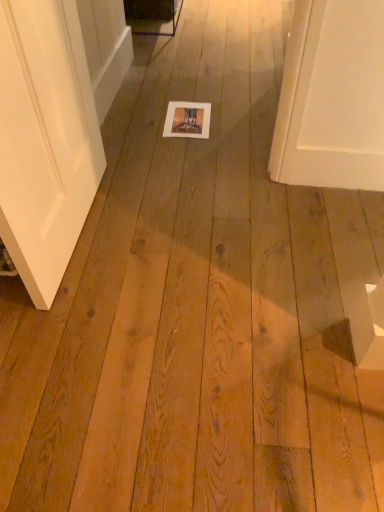
At what (x,y) coordinates should I click in order to perform the action: click on free point above matte cardboard postcard at center (from a real-world perspective). Please return your answer as a coordinate pair (x, y). The width and height of the screenshot is (384, 512). Looking at the image, I should click on (185, 112).